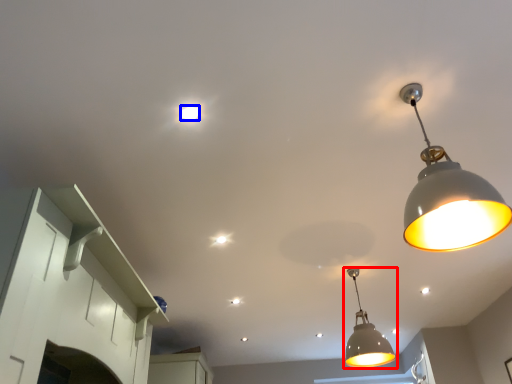
Question: Among these objects, which one is nearest to the camera, lamp (highlighted by a red box) or light bulb (highlighted by a blue box)?

Choices:
 (A) lamp
 (B) light bulb

Answer: (B)